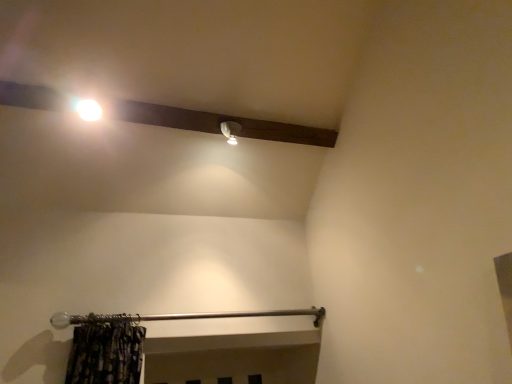
I want to click on white glossy light bulb at upper left, so click(x=88, y=109).

The height and width of the screenshot is (384, 512). What do you see at coordinates (88, 109) in the screenshot?
I see `white glossy light bulb at upper left` at bounding box center [88, 109].

Measure the distance between silver/metallic curtain rod at lower center and camera.

silver/metallic curtain rod at lower center is 6.87 feet away from camera.

Consider the image. In order to face silver/metallic curtain rod at lower center, should I rotate leftwards or rightwards?

To face it directly, rotate left by 7.144 degrees.

Describe the element at coordinates (177, 317) in the screenshot. The width and height of the screenshot is (512, 384). I see `silver/metallic curtain rod at lower center` at that location.

The height and width of the screenshot is (384, 512). Find the location of `silver/metallic curtain rod at lower center`. silver/metallic curtain rod at lower center is located at coordinates (x=177, y=317).

Where is `white glossy light bulb at upper left`? This screenshot has height=384, width=512. white glossy light bulb at upper left is located at coordinates (88, 109).

Is silver/metallic curtain rod at lower center to the left or to the right of white glossy light bulb at upper left in the image?

silver/metallic curtain rod at lower center is to the right of white glossy light bulb at upper left.

Does silver/metallic curtain rod at lower center lie behind white glossy light bulb at upper left?

No, the depth of silver/metallic curtain rod at lower center is less than that of white glossy light bulb at upper left.

Which point is more forward, (233, 315) or (96, 117)?

Point (96, 117)

From the image's perspective, who appears lower, silver/metallic curtain rod at lower center or white glossy light bulb at upper left?

silver/metallic curtain rod at lower center is shown below in the image.

From a real-world perspective, relative to white glossy light bulb at upper left, is silver/metallic curtain rod at lower center vertically above or below?

silver/metallic curtain rod at lower center is situated lower than white glossy light bulb at upper left in the real world.

Looking at their sizes, would you say silver/metallic curtain rod at lower center is wider or thinner than white glossy light bulb at upper left?

In the image, silver/metallic curtain rod at lower center appears to be wider than white glossy light bulb at upper left.

Looking at this image, considering the sizes of objects silver/metallic curtain rod at lower center and white glossy light bulb at upper left in the image provided, who is taller, silver/metallic curtain rod at lower center or white glossy light bulb at upper left?

With more height is silver/metallic curtain rod at lower center.

Can you confirm if silver/metallic curtain rod at lower center is bigger than white glossy light bulb at upper left?

Yes, silver/metallic curtain rod at lower center is bigger than white glossy light bulb at upper left.

Is silver/metallic curtain rod at lower center spatially inside white glossy light bulb at upper left, or outside of it?

silver/metallic curtain rod at lower center is located beyond the bounds of white glossy light bulb at upper left.

Is there a large distance between silver/metallic curtain rod at lower center and white glossy light bulb at upper left?

Yes, silver/metallic curtain rod at lower center and white glossy light bulb at upper left are quite far apart.

Could you tell me if silver/metallic curtain rod at lower center is turned towards white glossy light bulb at upper left?

No, silver/metallic curtain rod at lower center is not aimed at white glossy light bulb at upper left.

At what (x,y) coordinates should I click in order to perform the action: click on rail on the right of white glossy light bulb at upper left. Please return your answer as a coordinate pair (x, y). The height and width of the screenshot is (384, 512). Looking at the image, I should click on (177, 317).

Which object is positioned more to the right, white glossy light bulb at upper left or silver/metallic curtain rod at lower center?

silver/metallic curtain rod at lower center is more to the right.

Based on the photo, is white glossy light bulb at upper left closer to camera compared to silver/metallic curtain rod at lower center?

No, white glossy light bulb at upper left is further to the viewer.

Considering the positions of points (87, 100) and (213, 314), is point (87, 100) farther from camera compared to point (213, 314)?

No.

From the image's perspective, which one is positioned higher, white glossy light bulb at upper left or silver/metallic curtain rod at lower center?

From the image's view, white glossy light bulb at upper left is above.

In the scene shown: From a real-world perspective, who is located higher, white glossy light bulb at upper left or silver/metallic curtain rod at lower center?

In real-world perspective, white glossy light bulb at upper left is above.

Considering the sizes of objects white glossy light bulb at upper left and silver/metallic curtain rod at lower center in the image provided, who is thinner, white glossy light bulb at upper left or silver/metallic curtain rod at lower center?

With smaller width is white glossy light bulb at upper left.

Which of these two, white glossy light bulb at upper left or silver/metallic curtain rod at lower center, stands taller?

With more height is silver/metallic curtain rod at lower center.

In terms of size, does white glossy light bulb at upper left appear bigger or smaller than silver/metallic curtain rod at lower center?

Considering their sizes, white glossy light bulb at upper left takes up less space than silver/metallic curtain rod at lower center.

From the picture: Would you say white glossy light bulb at upper left is inside or outside silver/metallic curtain rod at lower center?

white glossy light bulb at upper left is outside silver/metallic curtain rod at lower center.

Would you consider white glossy light bulb at upper left to be distant from silver/metallic curtain rod at lower center?

Yes, white glossy light bulb at upper left and silver/metallic curtain rod at lower center are located far from each other.

Is white glossy light bulb at upper left aimed at silver/metallic curtain rod at lower center?

No, white glossy light bulb at upper left does not turn towards silver/metallic curtain rod at lower center.

How many degrees apart are the facing directions of white glossy light bulb at upper left and silver/metallic curtain rod at lower center?

There is a 1.25-degree angle between the facing directions of white glossy light bulb at upper left and silver/metallic curtain rod at lower center.

The width and height of the screenshot is (512, 384). What are the coordinates of `moonlight above the silver/metallic curtain rod at lower center (from the image's perspective)` in the screenshot? It's located at (88, 109).

This screenshot has width=512, height=384. Identify the location of moonlight above the silver/metallic curtain rod at lower center (from the image's perspective). (88, 109).

Image resolution: width=512 pixels, height=384 pixels. Identify the location of rail on the right of white glossy light bulb at upper left. (177, 317).